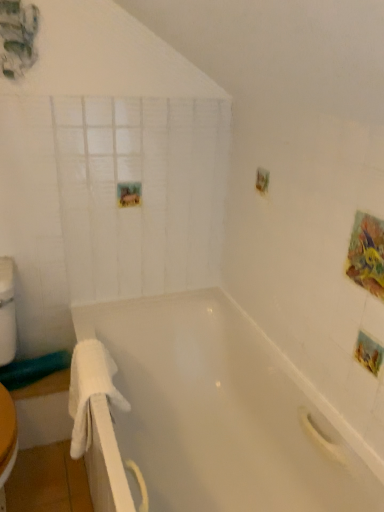
I want to click on free point above white fluffy towel at left (from a real-world perspective), so click(x=90, y=361).